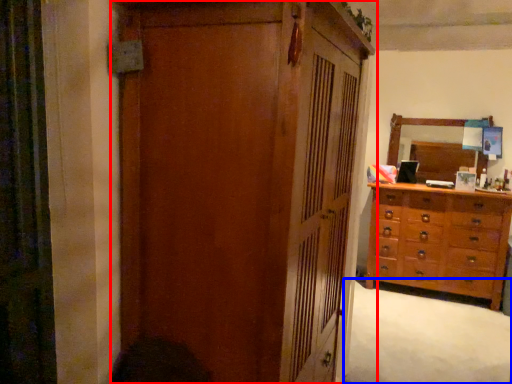
Question: Which object appears closest to the camera in this image, cupboard (highlighted by a red box) or plain (highlighted by a blue box)?

Choices:
 (A) cupboard
 (B) plain

Answer: (A)